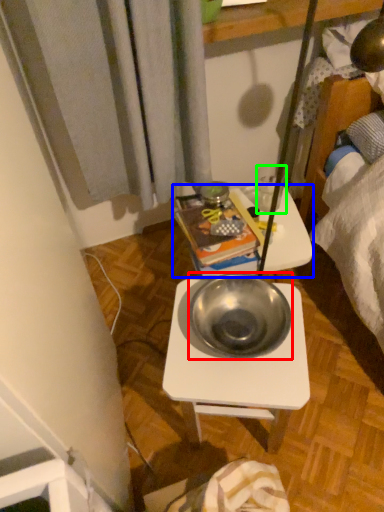
Question: Which is nearer to the bowl (highlighted by a red box)? table (highlighted by a blue box) or coffee cup (highlighted by a green box).

Choices:
 (A) table
 (B) coffee cup

Answer: (A)